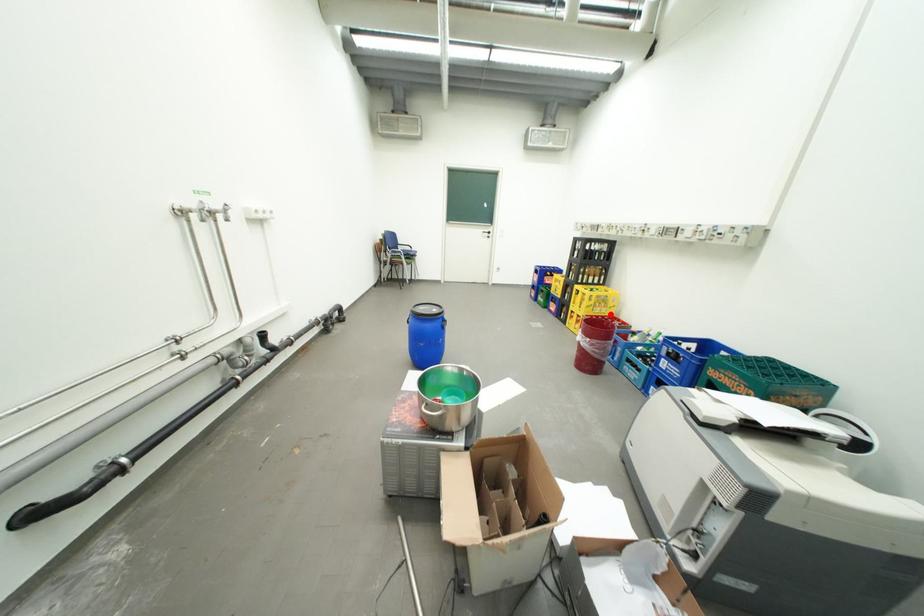
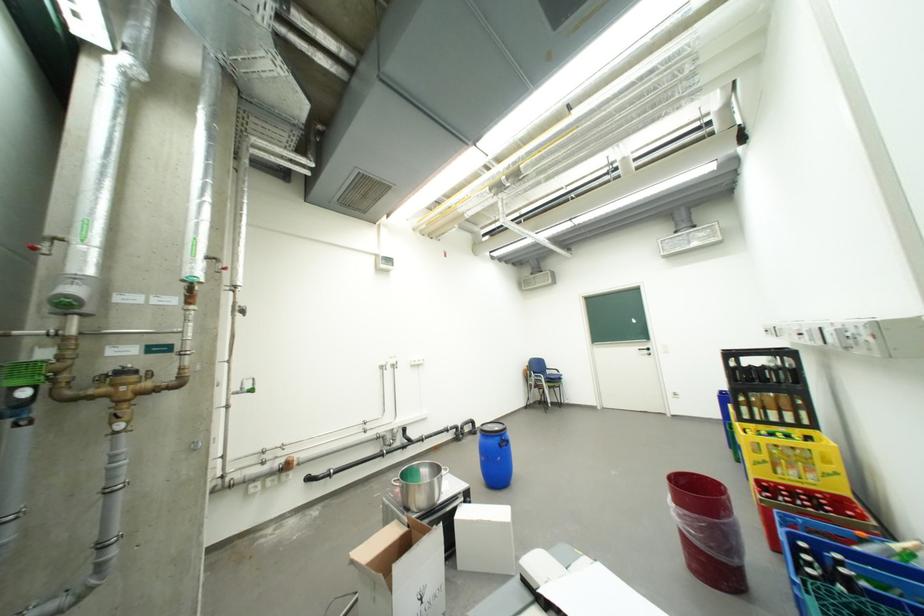
In the second image, find the point that corresponds to the highlighted location in the first image.

(810, 484)